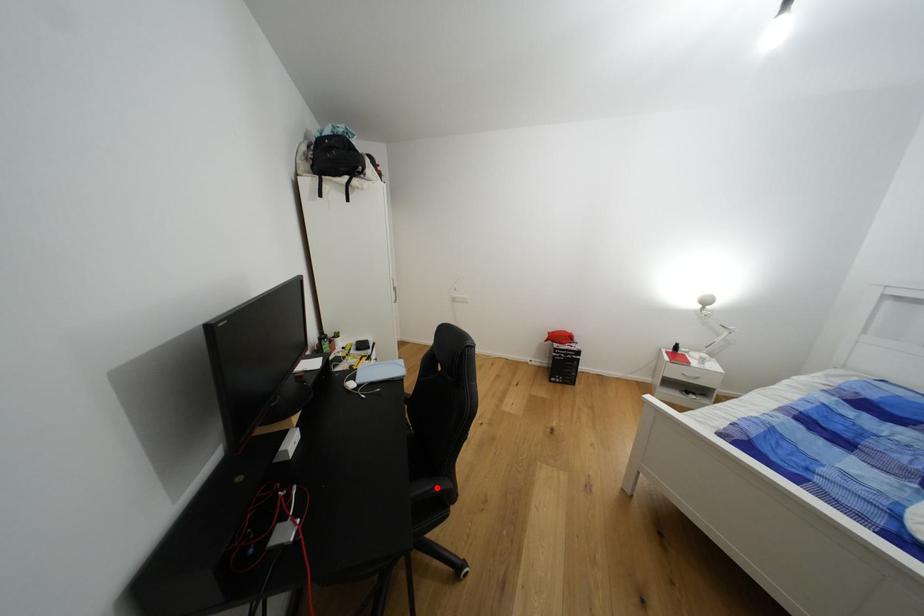
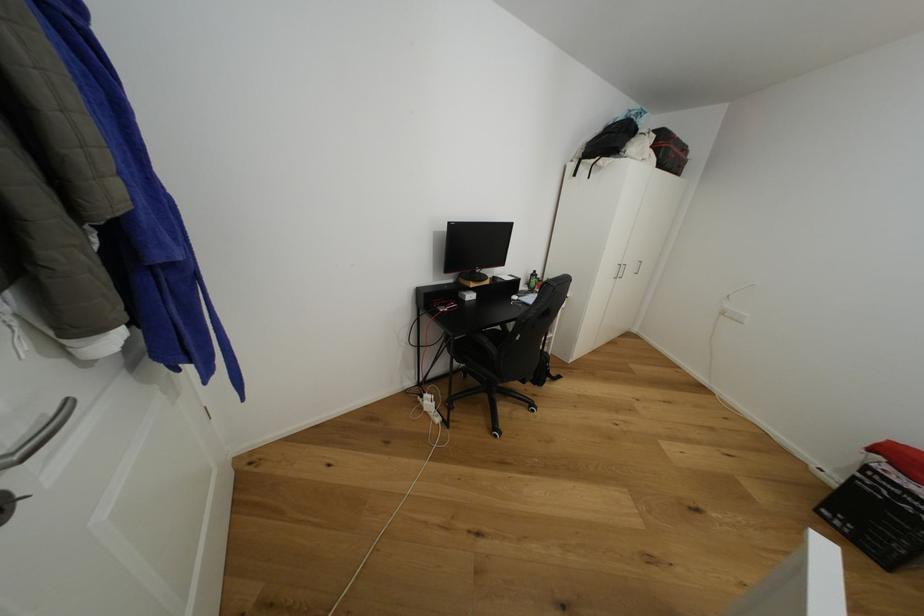
The point at the highlighted location is marked in the first image. Where is the corresponding point in the second image?

(491, 342)